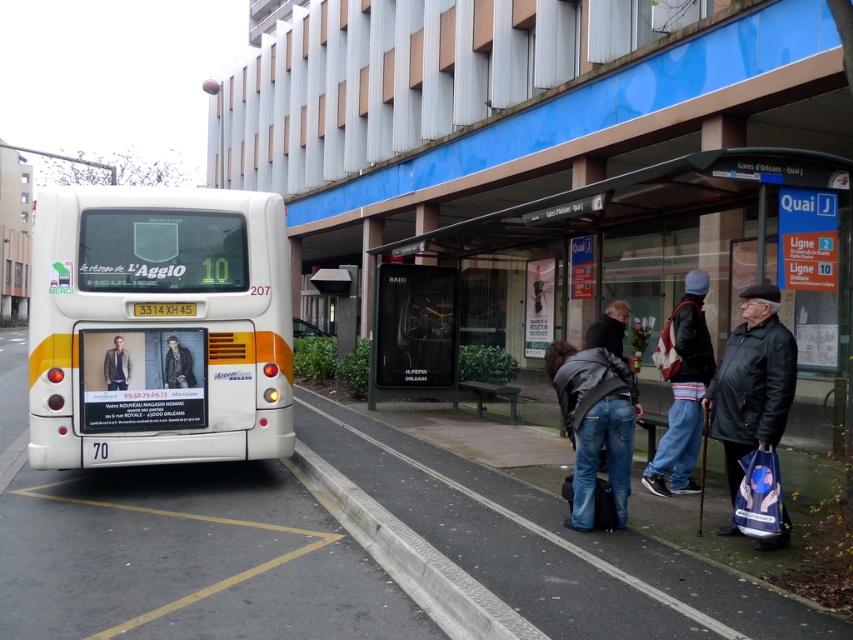
Can you confirm if transparent glass shelter at center is thinner than leather jacket at rear?

Incorrect, transparent glass shelter at center's width is not less than leather jacket at rear's.

Does transparent glass shelter at center have a larger size compared to leather jacket at rear?

Correct, transparent glass shelter at center is larger in size than leather jacket at rear.

Between point (833, 230) and point (178, 372), which one is positioned behind?

Positioned behind is point (178, 372).

You are a GUI agent. You are given a task and a screenshot of the screen. Output one action in this format:
    pyautogui.click(x=<x>, y=<y>)
    Task: Click on the transparent glass shelter at center
    This screenshot has width=853, height=640.
    Given the screenshot: What is the action you would take?
    pyautogui.click(x=671, y=260)

Describe the element at coordinates (671, 260) in the screenshot. The width and height of the screenshot is (853, 640). I see `transparent glass shelter at center` at that location.

Does transparent glass shelter at center have a larger size compared to gray concrete curb at lower center?

Correct, transparent glass shelter at center is larger in size than gray concrete curb at lower center.

The width and height of the screenshot is (853, 640). What do you see at coordinates (671, 260) in the screenshot?
I see `transparent glass shelter at center` at bounding box center [671, 260].

Where is `transparent glass shelter at center`? The width and height of the screenshot is (853, 640). transparent glass shelter at center is located at coordinates (671, 260).

Which is more to the right, transparent glass shelter at center or leather jacket at center?

Positioned to the right is transparent glass shelter at center.

Can you confirm if transparent glass shelter at center is bigger than leather jacket at center?

Yes.

Which is behind, point (541, 275) or point (605, 388)?

Positioned behind is point (541, 275).

This screenshot has width=853, height=640. In order to click on transparent glass shelter at center in this screenshot , I will do pos(671,260).